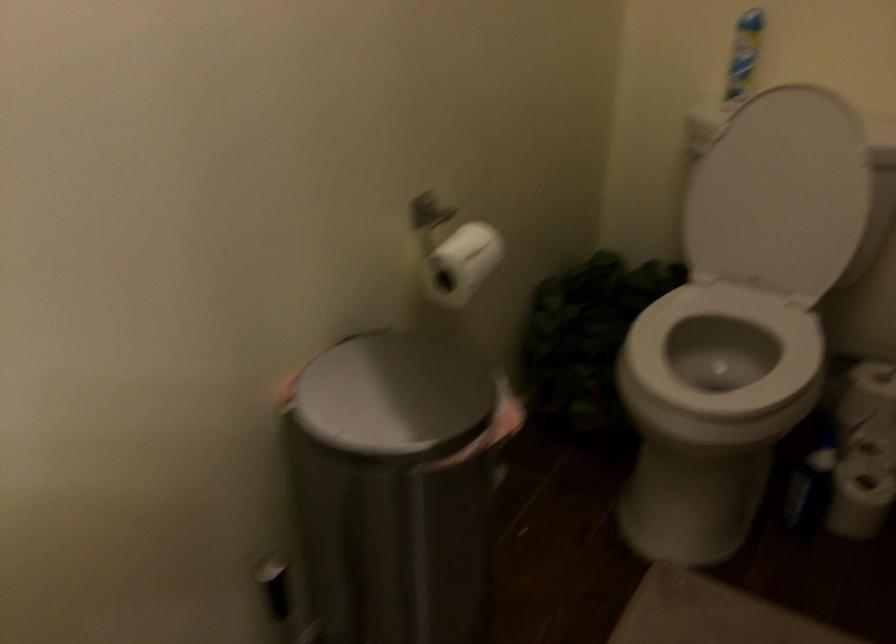
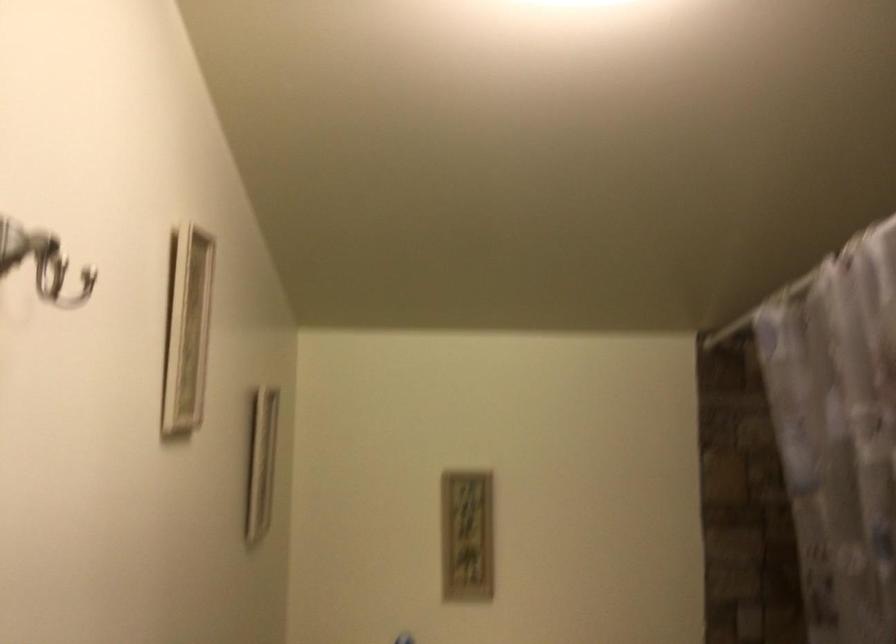
First-person continuous shooting, in which direction is the camera rotating?

The camera rotated toward right-up.